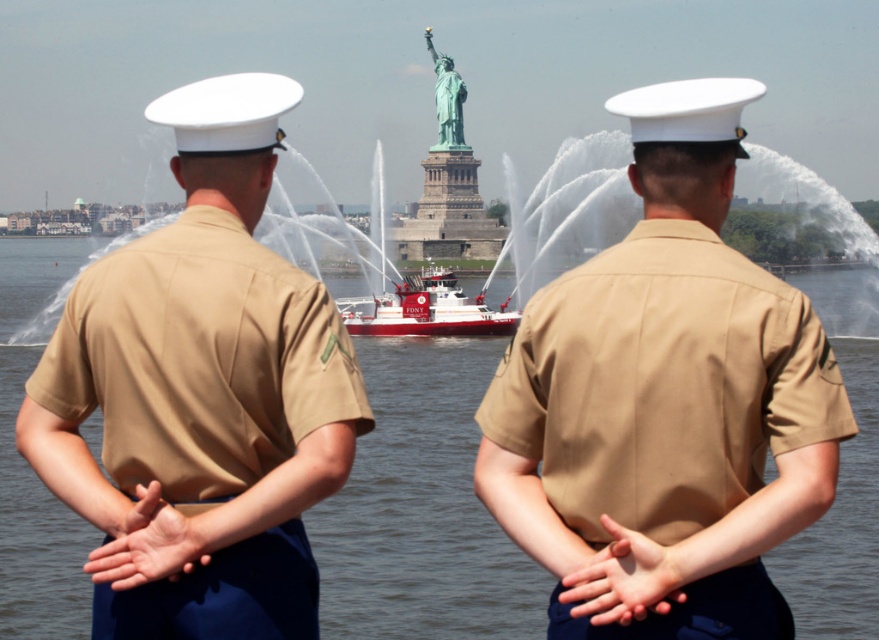
Question: Is khaki uniform at center wider than tan cotton shirt at center?

Choices:
 (A) yes
 (B) no

Answer: (B)

Question: Among these points, which one is farthest from the camera?

Choices:
 (A) (663, 513)
 (B) (249, 406)
 (C) (465, 541)

Answer: (C)

Question: Can you confirm if khaki uniform at center is thinner than tan cotton shirt at center?

Choices:
 (A) yes
 (B) no

Answer: (A)

Question: Does khaki uniform at center appear over red matte fireboat at center?

Choices:
 (A) yes
 (B) no

Answer: (B)

Question: Which object is farther from the camera taking this photo?

Choices:
 (A) green patina statue at center
 (B) tan cotton shirt at center

Answer: (A)

Question: Which of the following is the closest to the observer?

Choices:
 (A) click(x=13, y=252)
 (B) click(x=155, y=349)
 (C) click(x=378, y=308)
 (D) click(x=427, y=29)

Answer: (B)